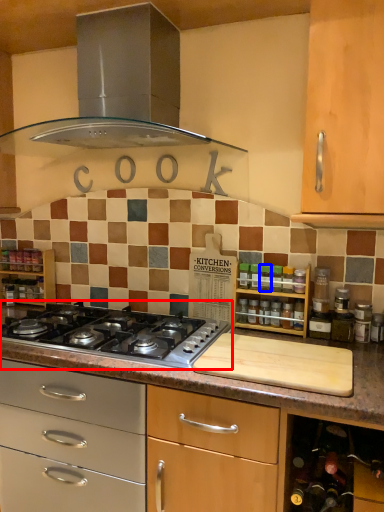
Question: Which object is closer to the camera taking this photo, gas stove (highlighted by a red box) or bottle (highlighted by a blue box)?

Choices:
 (A) gas stove
 (B) bottle

Answer: (A)